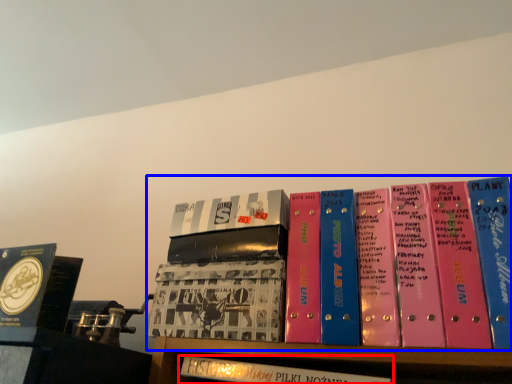
Question: Among these objects, which one is farthest to the camera, book (highlighted by a red box) or book (highlighted by a blue box)?

Choices:
 (A) book
 (B) book

Answer: (A)